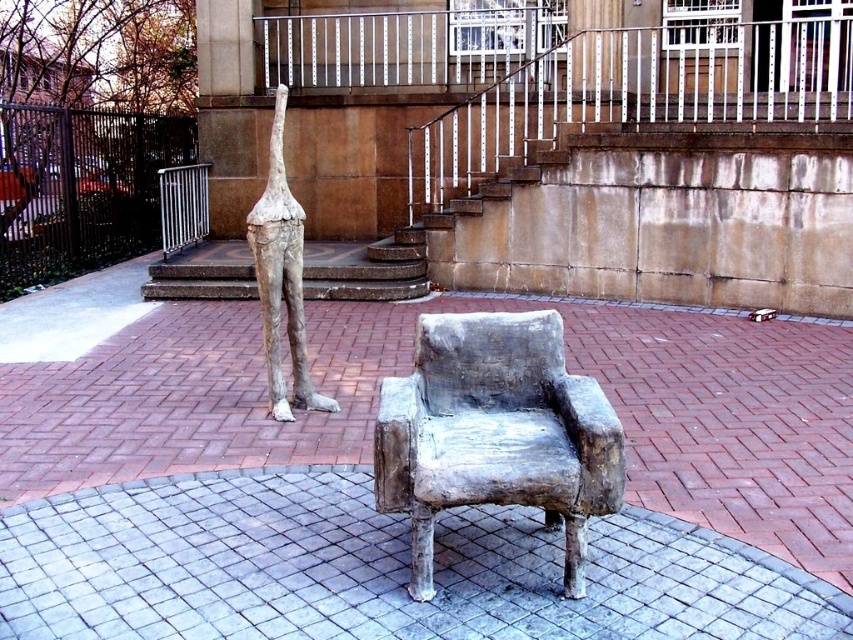
Question: Is matte concrete armchair at center above matte gray sculpture at center?

Choices:
 (A) yes
 (B) no

Answer: (B)

Question: Among these objects, which one is nearest to the camera?

Choices:
 (A) matte gray sculpture at center
 (B) matte concrete armchair at center

Answer: (B)

Question: Can you confirm if matte concrete armchair at center is smaller than matte gray sculpture at center?

Choices:
 (A) yes
 (B) no

Answer: (A)

Question: Which of the following is the farthest from the observer?

Choices:
 (A) matte concrete armchair at center
 (B) matte gray sculpture at center

Answer: (B)

Question: Is matte concrete armchair at center further to the viewer compared to matte gray sculpture at center?

Choices:
 (A) yes
 (B) no

Answer: (B)